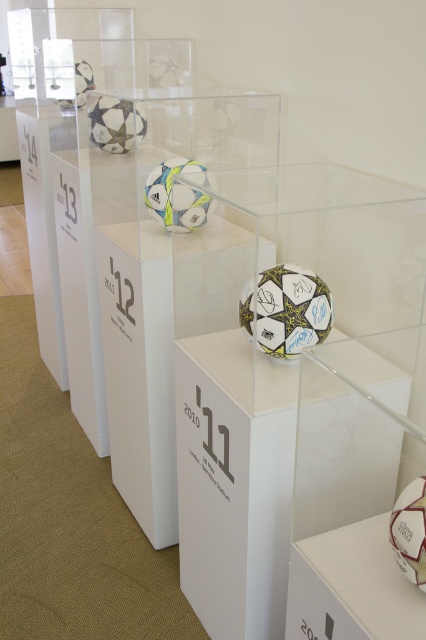
Question: Can you confirm if clear acrylic ball at center is positioned to the left of white matte soccer ball at upper left?

Choices:
 (A) yes
 (B) no

Answer: (B)

Question: Which object is farther from the camera taking this photo?

Choices:
 (A) white matte football at center
 (B) white matte soccer ball at upper left
 (C) clear acrylic ball at center

Answer: (B)

Question: Is clear acrylic ball at center below white matte soccer ball at upper left?

Choices:
 (A) no
 (B) yes

Answer: (B)

Question: Which of these objects is positioned closest to the white glossy soccer ball at lower right?

Choices:
 (A) clear acrylic ball at center
 (B) white leather football at center
 (C) white matte soccer ball at upper left
 (D) white matte football at center

Answer: (A)

Question: Does clear acrylic ball at center have a smaller size compared to white leather football at center?

Choices:
 (A) no
 (B) yes

Answer: (A)

Question: Which point is closer to the camera taking this photo?

Choices:
 (A) (276, 349)
 (B) (339, 602)
 (C) (92, 132)
 (D) (198, 342)

Answer: (B)